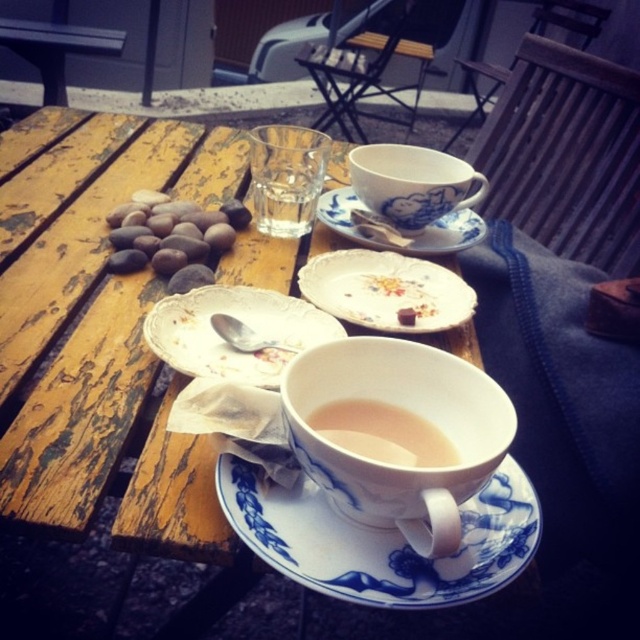
Question: From the image, what is the correct spatial relationship of translucent porcelain cup at center in relation to blue porcelain saucer at upper center?

Choices:
 (A) right
 (B) left

Answer: (B)

Question: Which object is positioned farthest from the porcelain plate at center?

Choices:
 (A) translucent porcelain cup at center
 (B) blue porcelain saucer at center

Answer: (B)

Question: Is porcelain plate at center smaller than blue porcelain saucer at upper center?

Choices:
 (A) yes
 (B) no

Answer: (A)

Question: Is smooth pebbles at center closer to camera compared to translucent porcelain cup at center?

Choices:
 (A) yes
 (B) no

Answer: (B)

Question: Among these objects, which one is farthest from the camera?

Choices:
 (A) porcelain plate at center
 (B) translucent porcelain cup at center
 (C) blue porcelain cup at upper center

Answer: (C)

Question: Which object is positioned closest to the white porcelain cup at center?

Choices:
 (A) blue porcelain saucer at upper center
 (B) smooth pebbles at center
 (C) translucent porcelain cup at center

Answer: (C)